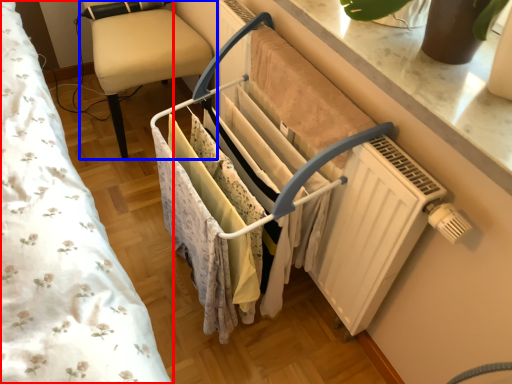
Question: Among these objects, which one is nearest to the camera, bed (highlighted by a red box) or furniture (highlighted by a blue box)?

Choices:
 (A) bed
 (B) furniture

Answer: (A)